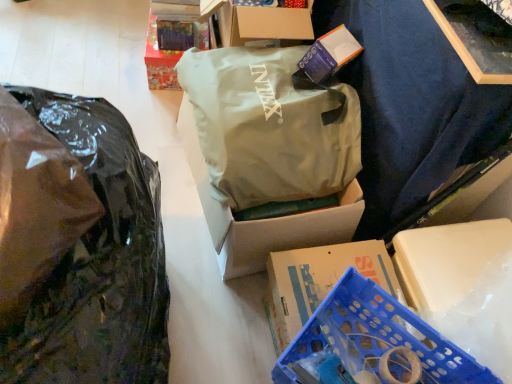
Question: Considering the positions of matte green fabric bag at center, the 1th plastic bag viewed from the right, and blue plastic crate at lower right in the image, is matte green fabric bag at center, the 1th plastic bag viewed from the right, wider or thinner than blue plastic crate at lower right?

Choices:
 (A) wide
 (B) thin

Answer: (A)

Question: From the image's perspective, is matte green fabric bag at center, the 1th plastic bag viewed from the right, located above or below blue plastic crate at lower right?

Choices:
 (A) above
 (B) below

Answer: (A)

Question: Which object is positioned farthest from the blue plastic crate at lower right?

Choices:
 (A) shiny paper box at upper left
 (B) transparent plastic bag at left, which is counted as the first plastic bag, starting from the left
 (C) blue plastic crate at lower right
 (D) matte green fabric bag at center, the 1th plastic bag viewed from the right

Answer: (A)

Question: Which object is the closest to the blue plastic crate at lower right?

Choices:
 (A) blue plastic crate at lower right
 (B) matte green fabric bag at center, the 1th plastic bag viewed from the right
 (C) transparent plastic bag at left, which ranks as the 2th plastic bag in right-to-left order
 (D) shiny paper box at upper left

Answer: (A)